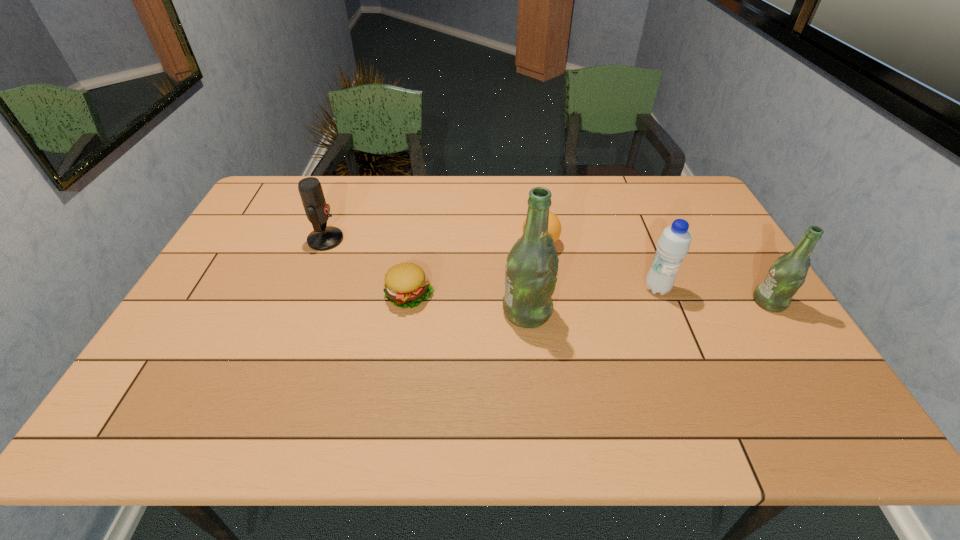
The width and height of the screenshot is (960, 540). What are the coordinates of `the left beer bottle` in the screenshot? It's located at (531, 268).

Locate an element on the screen. Image resolution: width=960 pixels, height=540 pixels. the tallest object is located at coordinates (531, 268).

At what (x,y) coordinates should I click in order to perform the action: click on the right beer bottle. Please return your answer as a coordinate pair (x, y). Looking at the image, I should click on (787, 274).

You are a GUI agent. You are given a task and a screenshot of the screen. Output one action in this format:
    pyautogui.click(x=<x>, y=<y>)
    Task: Click on the shorter beer bottle
    Image resolution: width=960 pixels, height=540 pixels.
    Given the screenshot: What is the action you would take?
    pyautogui.click(x=787, y=274)

In order to click on microphone in this screenshot , I will do `click(323, 237)`.

At what (x,y) coordinates should I click in order to perform the action: click on the second object from right to left. Please return your answer as a coordinate pair (x, y). This screenshot has width=960, height=540. Looking at the image, I should click on (673, 245).

This screenshot has height=540, width=960. I want to click on hamburger, so click(x=406, y=285).

The width and height of the screenshot is (960, 540). What are the coordinates of `the shortest object` in the screenshot? It's located at (406, 285).

This screenshot has height=540, width=960. In order to click on ping-pong ball in this screenshot , I will do `click(554, 226)`.

The image size is (960, 540). Identify the location of free space located 0.130m on the surface of the tallest object. (601, 312).